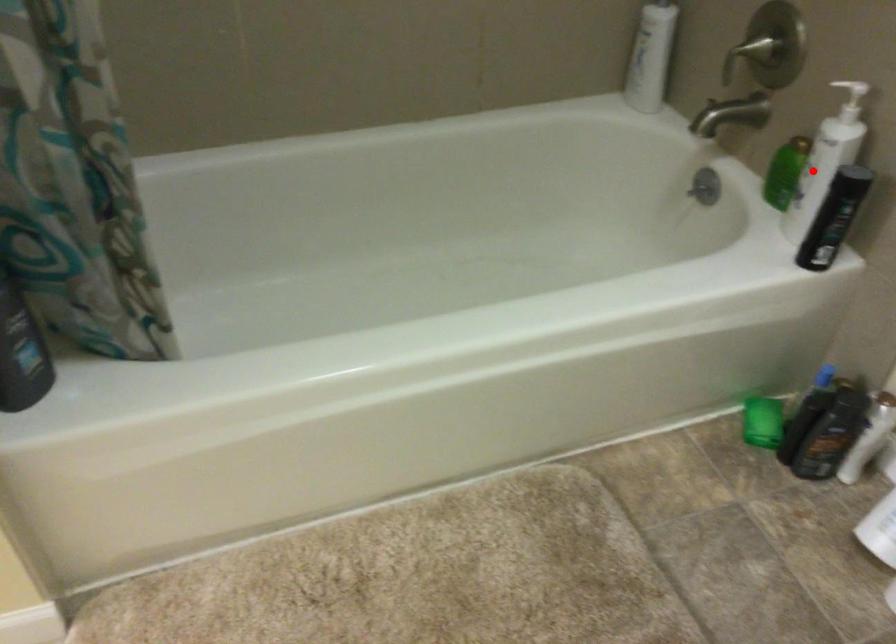
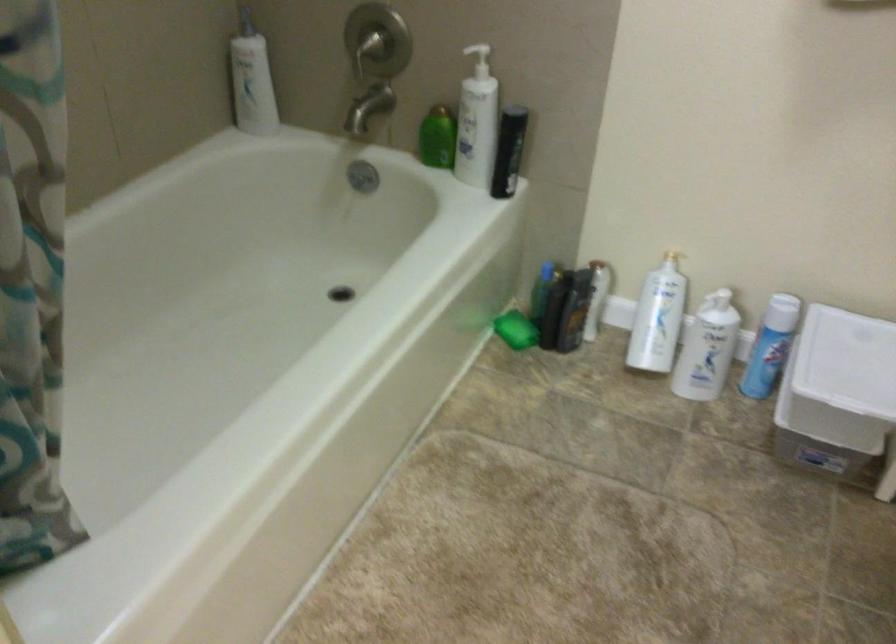
In the second image, find the point that corresponds to the highlighted location in the first image.

(477, 122)